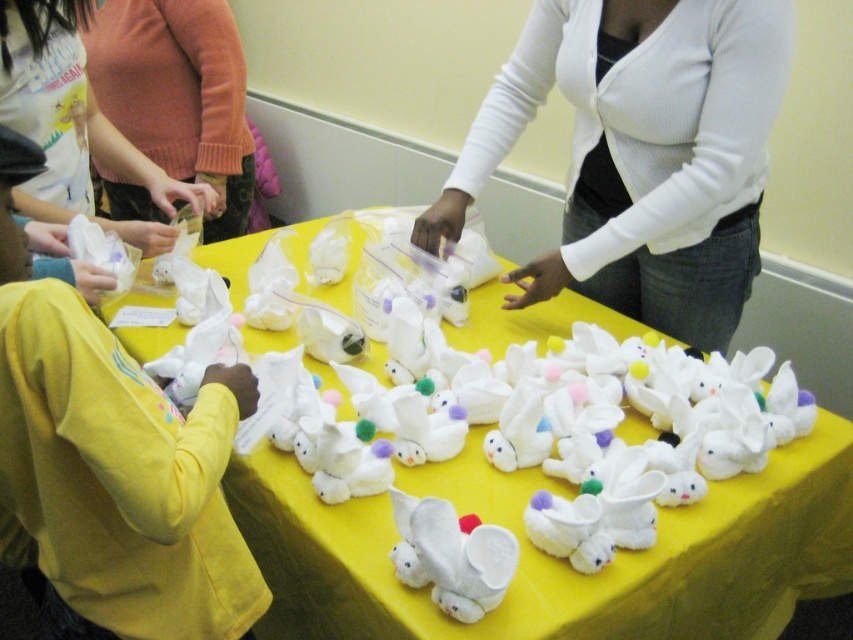
You are trying to decide which item to grab first, the white plush bunnies at center or the white ribbed sweater at upper center. Based on their positions, which one is closer to you?

The white plush bunnies at center is taller than the white ribbed sweater at upper center, so the white plush bunnies at center is closer to you.

You are organizing a craft fair and need to arrange the items on the table. The matte orange sweater at upper left and the white plush rabbit at center are both on the table. Which item is located to the left of the other?

The matte orange sweater at upper left is positioned on the left side of white plush rabbit at center, so the matte orange sweater at upper left is to the left of the white plush rabbit at center.

You are organizing a craft fair and need to display the white plush bunnies at center and the white plush rabbit at center on a shelf. Which one should you place first if you want to follow the rule of placing larger items first?

You should place the white plush bunnies at center first because it is bigger than the white plush rabbit at center.